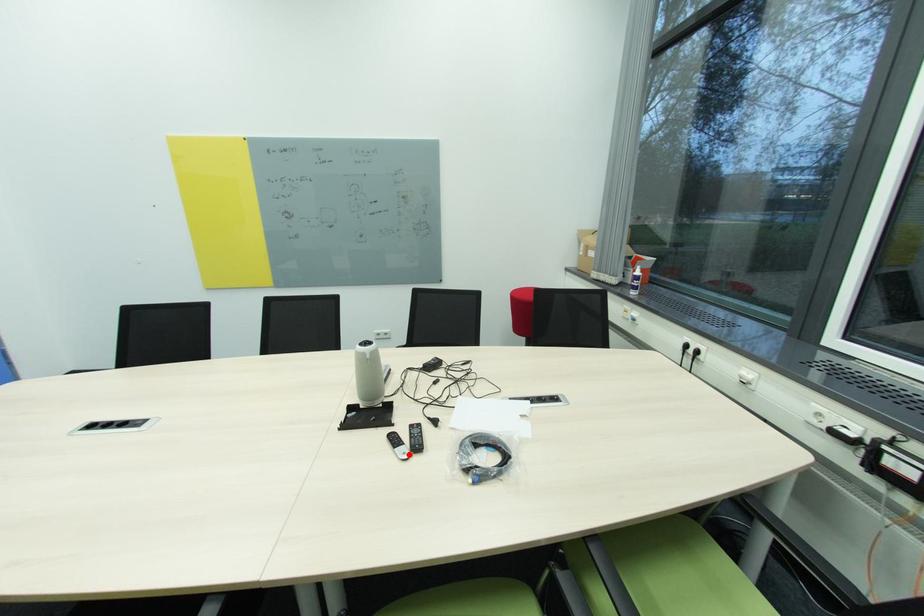
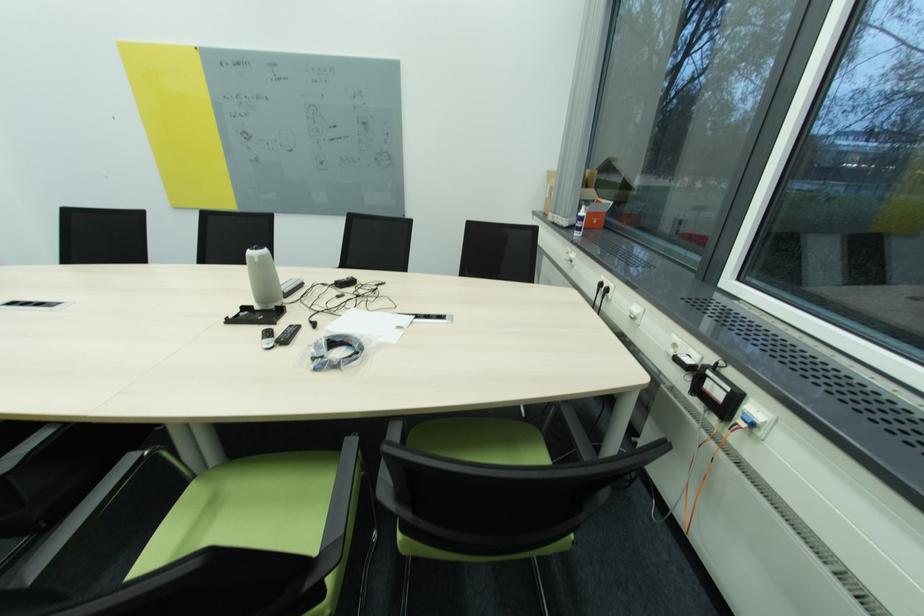
Question: I am providing you with two images of the same scene from different viewpoints. A red point is marked on the first image. Is the red point's position out of view in image 2?

Choices:
 (A) Yes
 (B) No

Answer: (B)